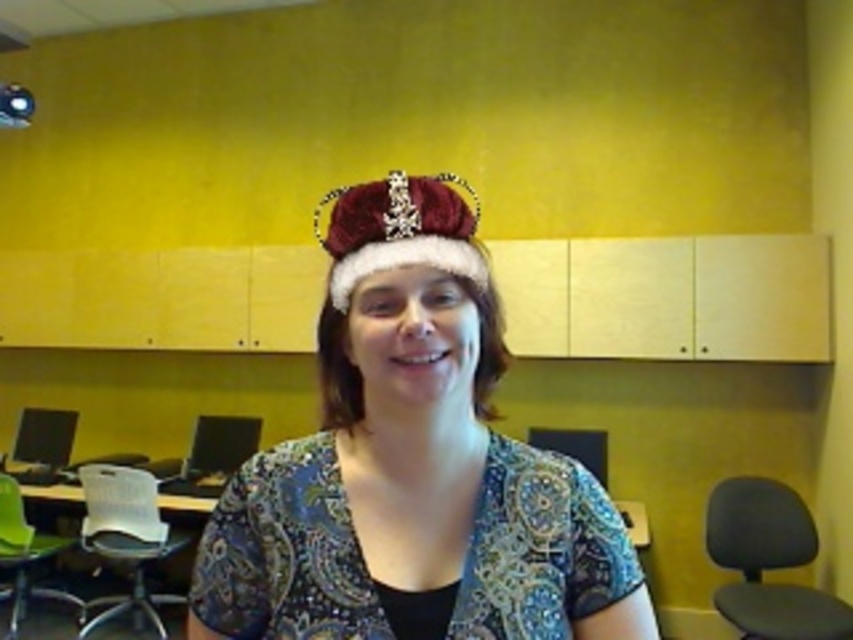
Question: Is velvet crown at center thinner than velvet red tiara at center?

Choices:
 (A) yes
 (B) no

Answer: (B)

Question: Can you confirm if velvet crown at center is positioned to the left of velvet red tiara at center?

Choices:
 (A) yes
 (B) no

Answer: (A)

Question: Among these objects, which one is nearest to the camera?

Choices:
 (A) velvet crown at center
 (B) velvet red tiara at center

Answer: (A)

Question: Which point is closer to the camera?

Choices:
 (A) velvet crown at center
 (B) velvet red tiara at center

Answer: (A)

Question: Is velvet crown at center closer to the viewer compared to velvet red tiara at center?

Choices:
 (A) yes
 (B) no

Answer: (A)